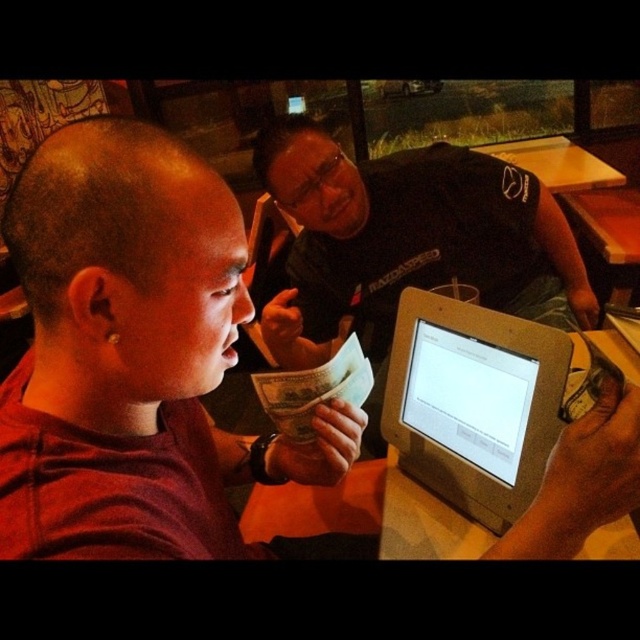
You are a customer at a cafe and want to place your coffee order. You see a silver metallic tablet at center and a silver metallic monitor at center on the table. Which one is on the left side from your perspective?

The silver metallic tablet at center is on the left side from your perspective since it is positioned to the left of the silver metallic monitor at center.

You are a customer at the table and want to place your phone on the silver metallic tablet at center and the wooden table at upper center. Which surface will your phone be closer to your eyes?

The silver metallic tablet at center will be closer to your eyes because it is closer to the viewer than the wooden table at upper center.